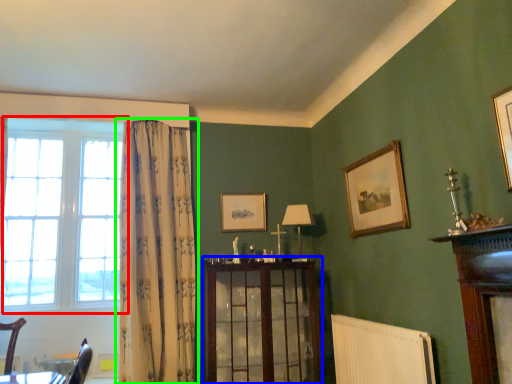
Question: Which object is positioned farthest from window (highlighted by a red box)? Select from dresser (highlighted by a blue box) and curtain (highlighted by a green box).

Choices:
 (A) dresser
 (B) curtain

Answer: (A)